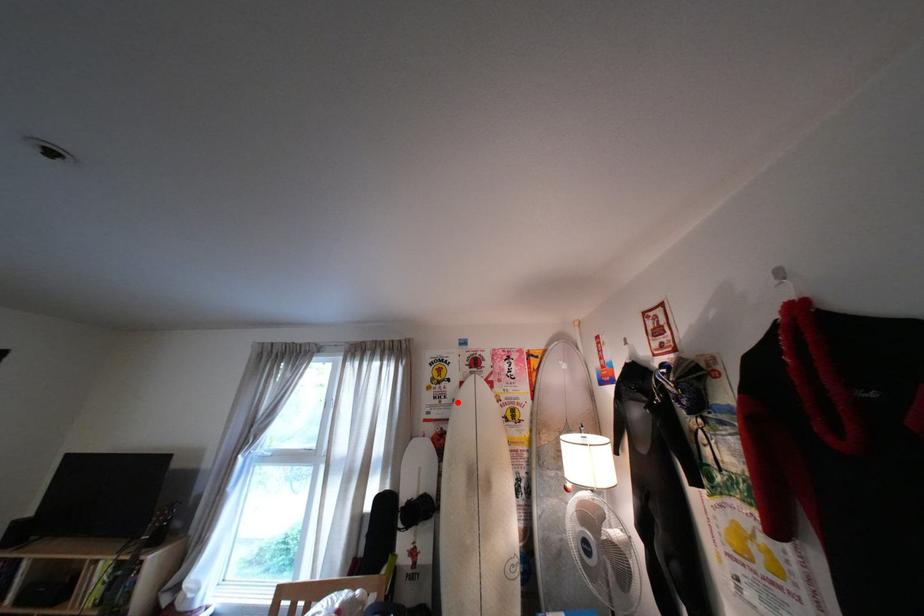
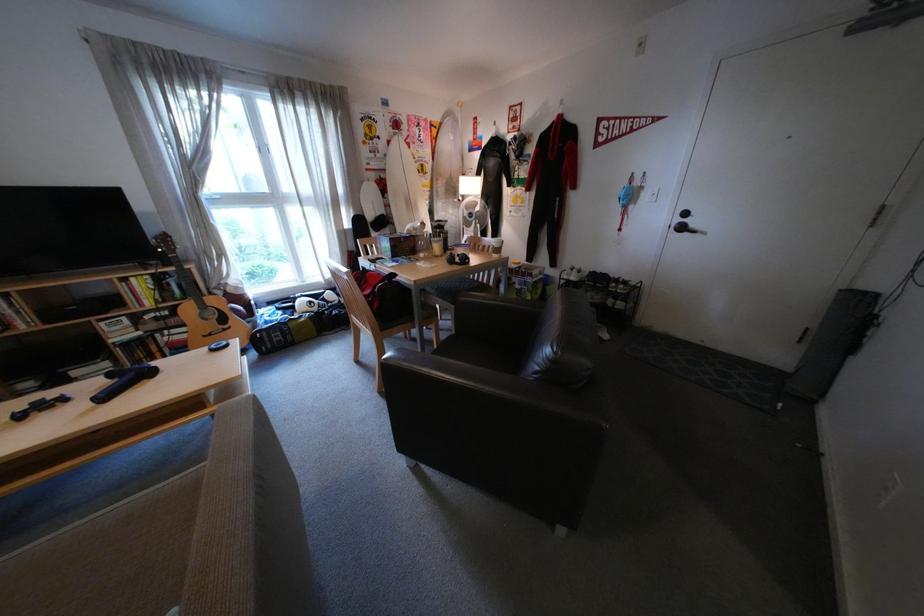
Find the pixel in the second image that matches the highlighted location in the first image.

(392, 156)